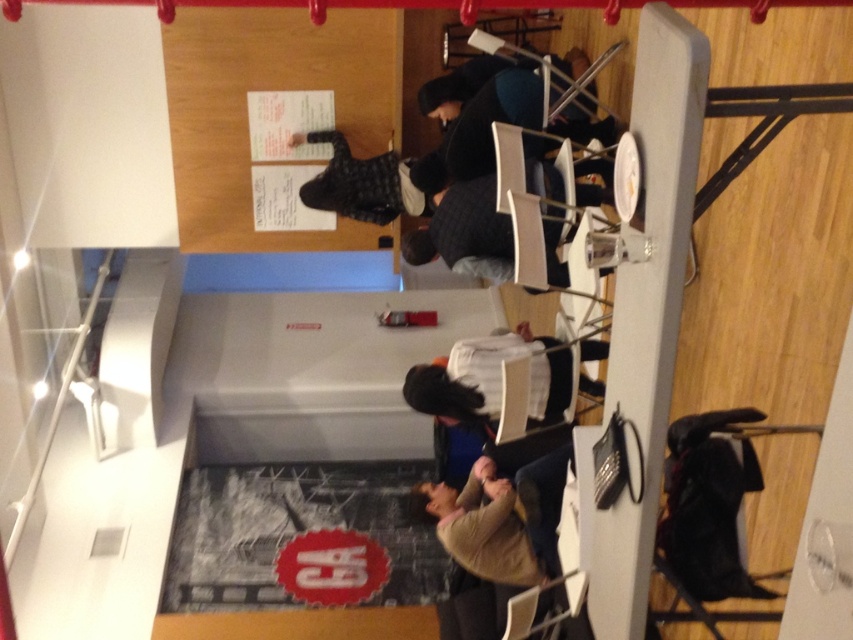
Based on the photo, you are standing at the entrance of the room and want to find the white fabric shirt at center. Based on the room layout described, where would you look relative to the table with white chairs around it?

The white fabric shirt at center is located at the coordinates 0.592 on the x axis and 0.577 on the y axis relative to the table with white chairs around it.

You are a customer in the cafe and you want to place your checkered fabric jacket at center on the table. The table is at coordinates 0.3, 0.4. Can you place it there?

The checkered fabric jacket at center is already at the table coordinates (340, 192), so yes, it can be placed there.

You are a customer at the cafe and you see the light brown sweater at lower center and the white fabric shirt at center. Which item is taller?

The light brown sweater at lower center is taller than the white fabric shirt at center.